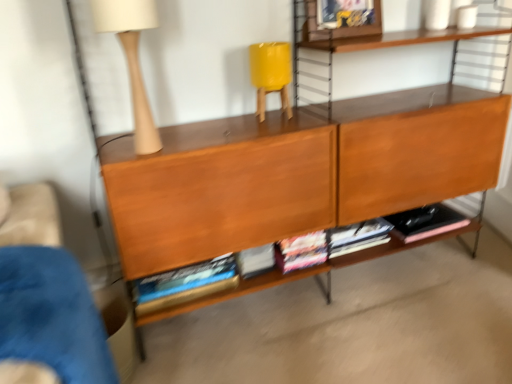
What do you see at coordinates (334, 261) in the screenshot? I see `hardcover books at center` at bounding box center [334, 261].

The image size is (512, 384). I want to click on hardcover books at center, so click(334, 261).

Identify the location of brown wood shelf at center. (297, 172).

Is hardcover books at center looking in the opposite direction of blue fabric armchair at lower left?

No, hardcover books at center is not facing away from blue fabric armchair at lower left.

Is hardcover books at center shorter than blue fabric armchair at lower left?

Correct, hardcover books at center is not as tall as blue fabric armchair at lower left.

Identify the location of armchair in front of the hardcover books at center. This screenshot has height=384, width=512. (51, 315).

How distant is matte beige table lamp at upper left from brown wood shelf at center?

matte beige table lamp at upper left is 23.25 inches away from brown wood shelf at center.

Locate an element on the screen. The height and width of the screenshot is (384, 512). shelf below the matte beige table lamp at upper left (from a real-world perspective) is located at coordinates click(x=297, y=172).

Is matte beige table lamp at upper left next to brown wood shelf at center and touching it?

No, matte beige table lamp at upper left is not with brown wood shelf at center.

From the picture: How many degrees apart are the facing directions of matte beige table lamp at upper left and brown wood shelf at center?

They differ by 3.75 degrees in their facing directions.

From the image's perspective, which is above, hardcover books at center or brown wood shelf at center?

brown wood shelf at center.

Considering the sizes of hardcover books at center and brown wood shelf at center in the image, is hardcover books at center bigger or smaller than brown wood shelf at center?

In the image, hardcover books at center appears to be smaller than brown wood shelf at center.

I want to click on book lying on the left of brown wood shelf at center, so click(x=334, y=261).

Is hardcover books at center not close to brown wood shelf at center?

hardcover books at center is actually quite close to brown wood shelf at center.

What's the angular difference between blue fabric armchair at lower left and brown wood shelf at center's facing directions?

There is a 2.37-degree angle between the facing directions of blue fabric armchair at lower left and brown wood shelf at center.

Locate an element on the screen. The width and height of the screenshot is (512, 384). shelf above the blue fabric armchair at lower left (from a real-world perspective) is located at coordinates (297, 172).

Does blue fabric armchair at lower left have a greater height compared to brown wood shelf at center?

Incorrect, the height of blue fabric armchair at lower left is not larger of that of brown wood shelf at center.

Is blue fabric armchair at lower left bigger than brown wood shelf at center?

Incorrect, blue fabric armchair at lower left is not larger than brown wood shelf at center.

From the image's perspective, which object appears higher, brown wood shelf at center or hardcover books at center?

brown wood shelf at center.

Would you say brown wood shelf at center is a long distance from hardcover books at center?

brown wood shelf at center is near hardcover books at center, not far away.

In the image, is brown wood shelf at center positioned in front of or behind hardcover books at center?

In the image, brown wood shelf at center appears in front of hardcover books at center.

Can you confirm if brown wood shelf at center is smaller than hardcover books at center?

Actually, brown wood shelf at center might be larger than hardcover books at center.

Between brown wood shelf at center and blue fabric armchair at lower left, which one has less height?

blue fabric armchair at lower left is shorter.

Is brown wood shelf at center in contact with blue fabric armchair at lower left?

No, brown wood shelf at center is not in contact with blue fabric armchair at lower left.

From the picture: Is brown wood shelf at center smaller than blue fabric armchair at lower left?

No.

Is point (128, 273) in front of point (95, 364)?

No, it is not.

Is blue fabric armchair at lower left wider than hardcover books at center?

Indeed, blue fabric armchair at lower left has a greater width compared to hardcover books at center.

Is blue fabric armchair at lower left at the left side of hardcover books at center?

Yes, blue fabric armchair at lower left is to the left of hardcover books at center.

Where is `book behind the blue fabric armchair at lower left`? The width and height of the screenshot is (512, 384). book behind the blue fabric armchair at lower left is located at coordinates (334, 261).

This screenshot has height=384, width=512. What are the coordinates of `book that is under the blue fabric armchair at lower left (from a real-world perspective)` in the screenshot? It's located at tap(334, 261).

The width and height of the screenshot is (512, 384). I want to click on table lamp that is behind the brown wood shelf at center, so click(x=132, y=59).

From the picture: When comparing their distances from matte beige table lamp at upper left, does hardcover books at center or blue fabric armchair at lower left seem closer?

blue fabric armchair at lower left.

From the image, which object appears to be nearer to blue fabric armchair at lower left, hardcover books at center or brown wood shelf at center?

Based on the image, brown wood shelf at center appears to be nearer to blue fabric armchair at lower left.

Based on their spatial positions, is matte beige table lamp at upper left or blue fabric armchair at lower left closer to brown wood shelf at center?

Among the two, matte beige table lamp at upper left is located nearer to brown wood shelf at center.

Based on their spatial positions, is hardcover books at center or blue fabric armchair at lower left closer to brown wood shelf at center?

hardcover books at center is closer to brown wood shelf at center.

When comparing their distances from hardcover books at center, does brown wood shelf at center or blue fabric armchair at lower left seem closer?

brown wood shelf at center is closer to hardcover books at center.

Considering their positions, is hardcover books at center positioned closer to matte beige table lamp at upper left than brown wood shelf at center?

brown wood shelf at center is positioned closer to the anchor matte beige table lamp at upper left.

From the image, which object appears to be farther from blue fabric armchair at lower left, matte beige table lamp at upper left or hardcover books at center?

hardcover books at center.

From the image, which object appears to be nearer to matte beige table lamp at upper left, brown wood shelf at center or blue fabric armchair at lower left?

brown wood shelf at center.

Image resolution: width=512 pixels, height=384 pixels. What are the coordinates of `shelf between blue fabric armchair at lower left and hardcover books at center along the z-axis` in the screenshot? It's located at (297, 172).

Where is `shelf between matte beige table lamp at upper left and blue fabric armchair at lower left vertically`? The image size is (512, 384). shelf between matte beige table lamp at upper left and blue fabric armchair at lower left vertically is located at coordinates (297, 172).

You are a GUI agent. You are given a task and a screenshot of the screen. Output one action in this format:
    pyautogui.click(x=<x>, y=<y>)
    Task: Click on the book between matte beige table lamp at upper left and brown wood shelf at center in the horizontal direction
    The width and height of the screenshot is (512, 384).
    Given the screenshot: What is the action you would take?
    pyautogui.click(x=334, y=261)

Locate an element on the screen. table lamp positioned between blue fabric armchair at lower left and hardcover books at center from near to far is located at coordinates (132, 59).